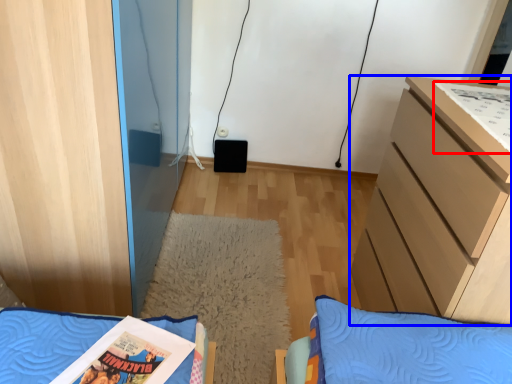
Question: Which object is closer to the camera taking this photo, comic book (highlighted by a red box) or chest of drawers (highlighted by a blue box)?

Choices:
 (A) comic book
 (B) chest of drawers

Answer: (B)